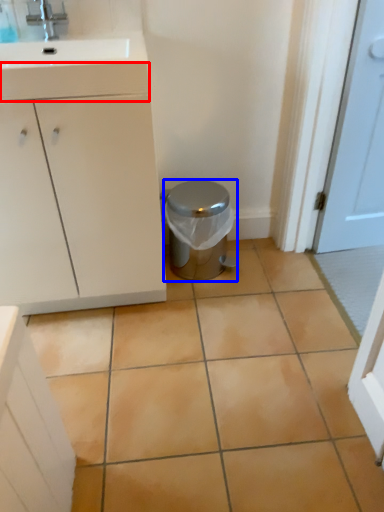
Question: Which object appears farthest to the camera in this image, drawer (highlighted by a red box) or potty (highlighted by a blue box)?

Choices:
 (A) drawer
 (B) potty

Answer: (B)